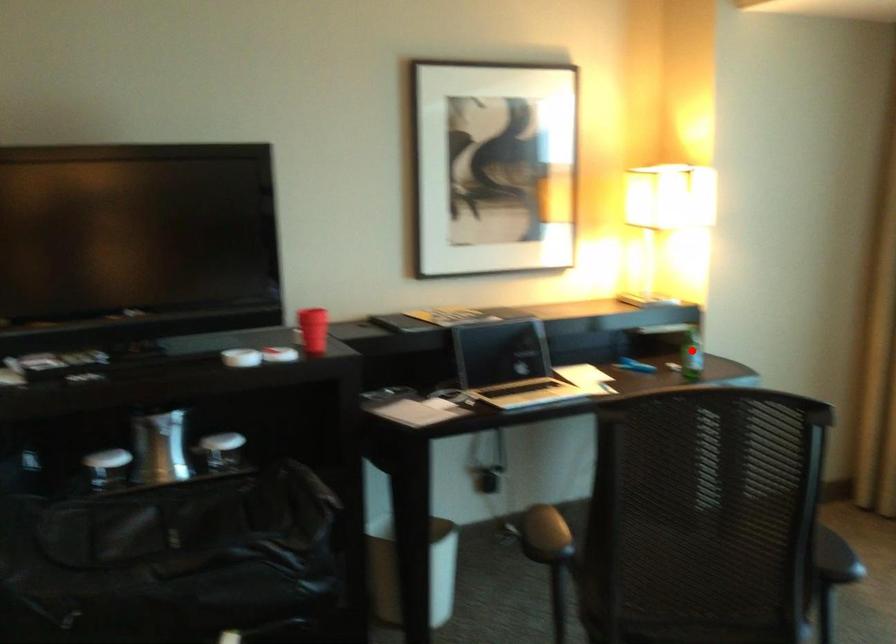
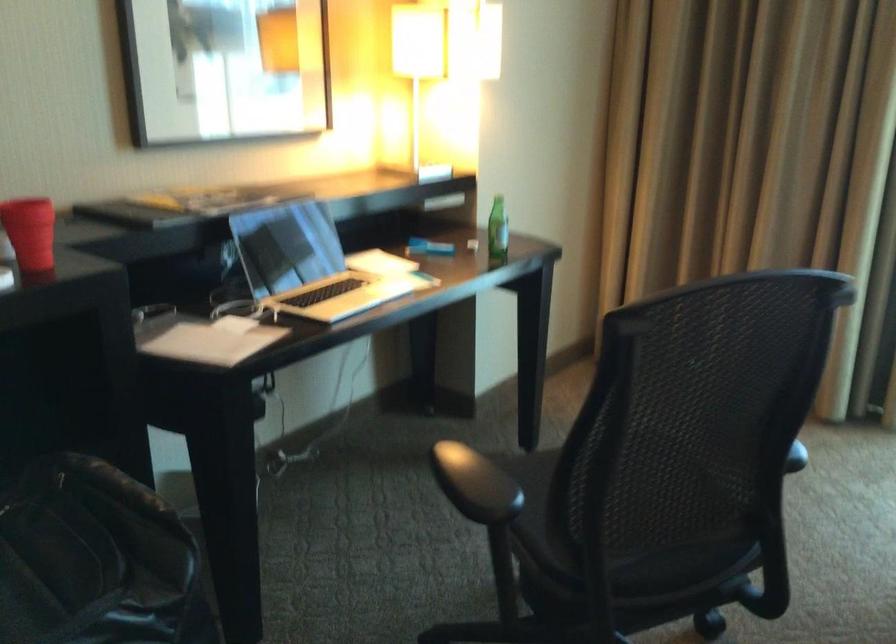
Locate, in the second image, the point that corresponds to the highlighted location in the first image.

(497, 229)